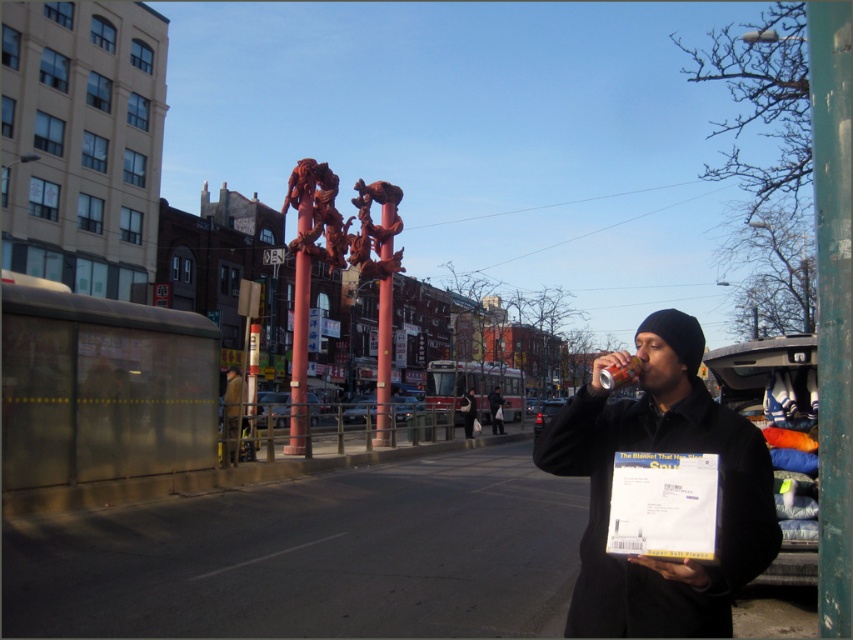
You are a fashion designer observing the urban street scene. You notice the dark brown leather jacket at center and the black knit cap at upper right. Which clothing item appears to be smaller in size?

The dark brown leather jacket at center appears to be smaller in size compared to the black knit cap at upper right according to the description.

You are a delivery person who needs to deliver a package to the matte black beanie at upper right located at point (662, 451). The delivery drone can only fly up to 0.5 units. Can the drone reach the matte black beanie at upper right?

The matte black beanie at upper right is located at point (662, 451). Since the drone can fly up to 0.5 units, it cannot reach the beanie as the distance exceeds its maximum range.